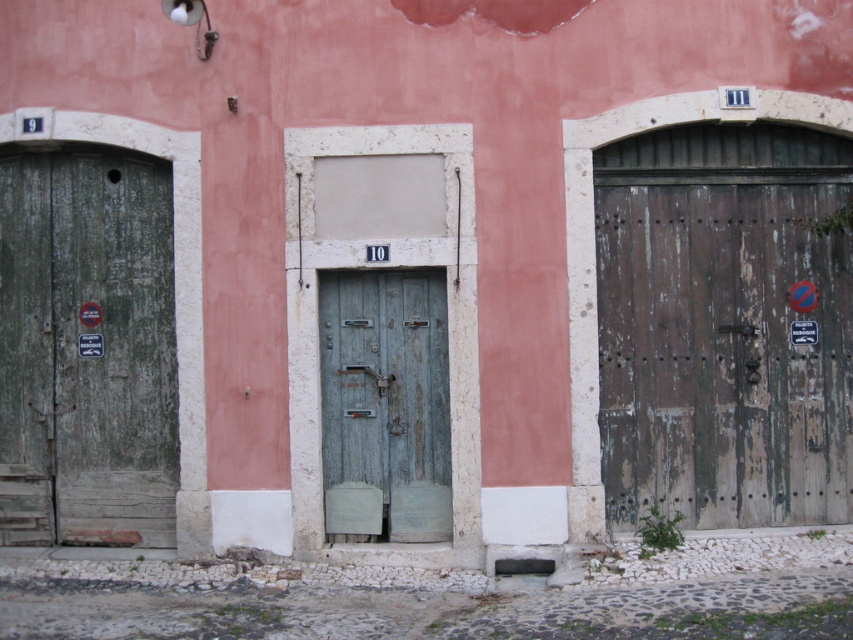
You are standing in front of the building and want to enter through the green weathered wood door at left and the green weathered wood door at center. Which door should you approach first to reach the one closer to you?

You should approach the green weathered wood door at left first because it is closer to you than the green weathered wood door at center.

You are a delivery person with a cart that is 5 feet wide. You need to move through the space between the green weathered wood door at left and the green weathered wood door at center. Can your cart fit through the space between them?

The green weathered wood door at left and green weathered wood door at center are 4.83 feet apart from each other. Since your cart is 5 feet wide, it cannot fit through the space between them.

You are standing in front of the building with three doors. You need to find the green weathered wood door at left. According to the coordinates provided, where exactly is it positioned?

The green weathered wood door at left is located at point 0.547 on the x axis and 0.102 on the y axis.